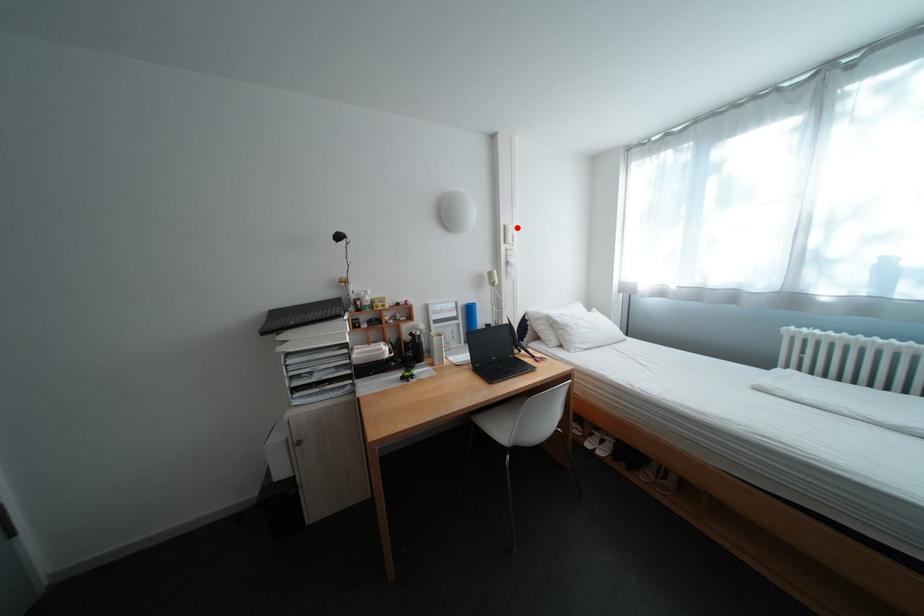
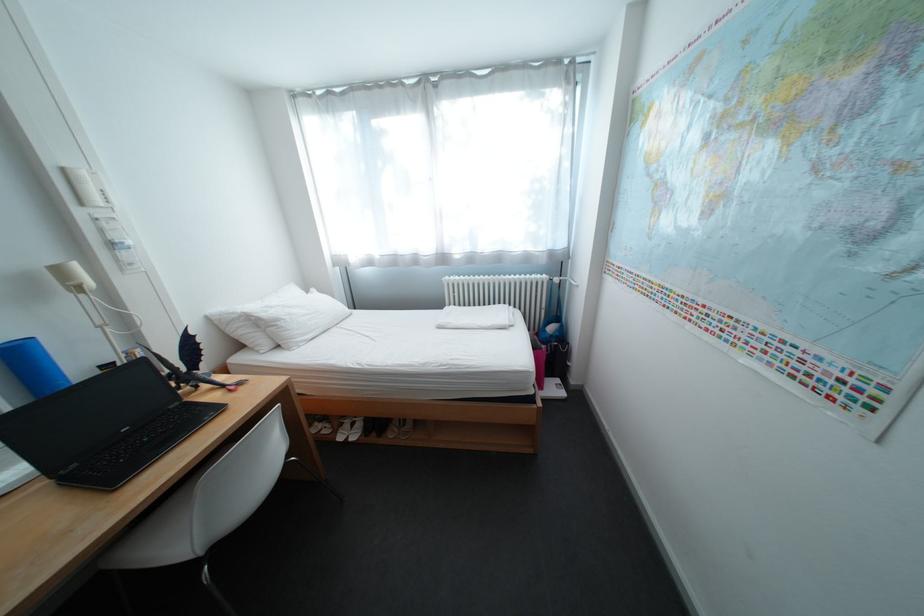
Find the pixel in the second image that matches the highlighted location in the first image.

(76, 171)